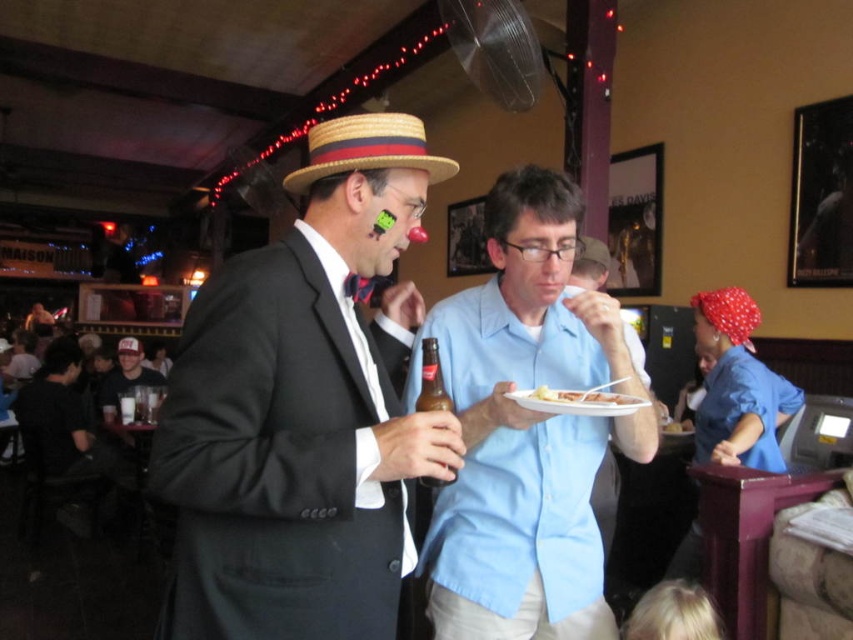
You are a photographer positioned at the camera. You want to take a photo that includes both point (590,440) and point (354,166). Which point should you focus on first to ensure both are in focus?

You should focus on point (354,166) first because it is closer to the camera than point (590,440). By focusing on the closer point, the depth of field may also cover the farther point, ensuring both are in focus.